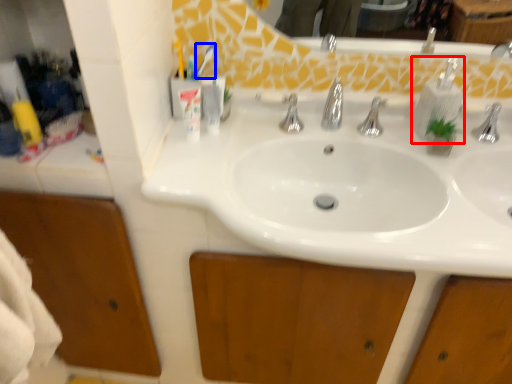
Question: Which of the following is the closest to the observer, soap dispenser (highlighted by a red box) or toothbrush (highlighted by a blue box)?

Choices:
 (A) soap dispenser
 (B) toothbrush

Answer: (A)